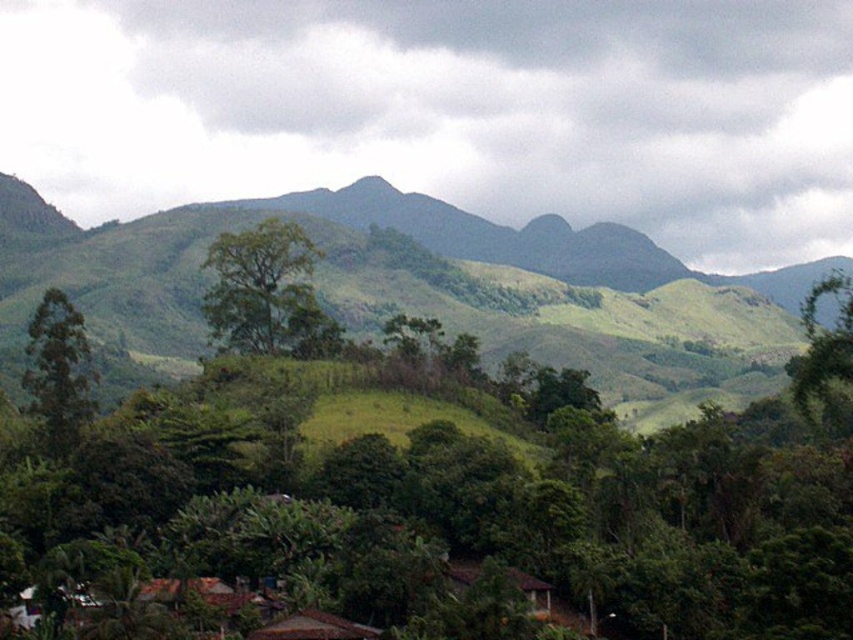
Question: Can you confirm if brown corrugated roof at lower center is positioned to the left of brown thatched hut at lower center?

Choices:
 (A) yes
 (B) no

Answer: (A)

Question: Does brown corrugated roof at lower center have a larger size compared to brown thatched hut at lower center?

Choices:
 (A) yes
 (B) no

Answer: (B)

Question: Is brown corrugated roof at lower center smaller than brown thatched hut at lower center?

Choices:
 (A) no
 (B) yes

Answer: (B)

Question: Considering the real-world distances, which object is farthest from the green leafy tree at left?

Choices:
 (A) green leafy tree at center
 (B) green leafy tree at right

Answer: (B)

Question: Which object appears closest to the camera in this image?

Choices:
 (A) brown corrugated roof at lower center
 (B) green leafy tree at center
 (C) brown thatched hut at lower center
 (D) green grassy hill at center

Answer: (C)

Question: Which is farther from the brown corrugated roof at lower center?

Choices:
 (A) brown thatched hut at lower center
 (B) green leafy tree at right
 (C) green leafy tree at center
 (D) green leafy tree at left

Answer: (C)